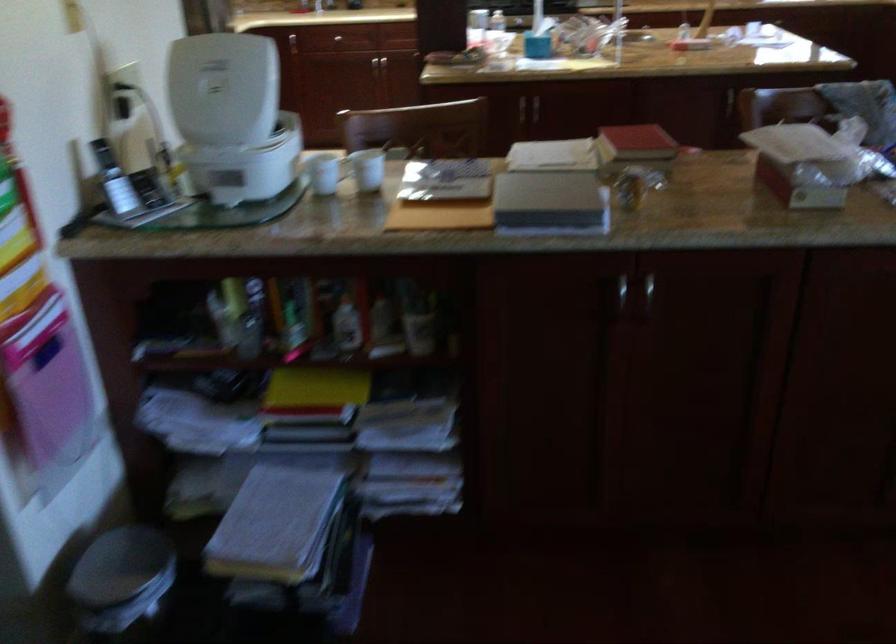
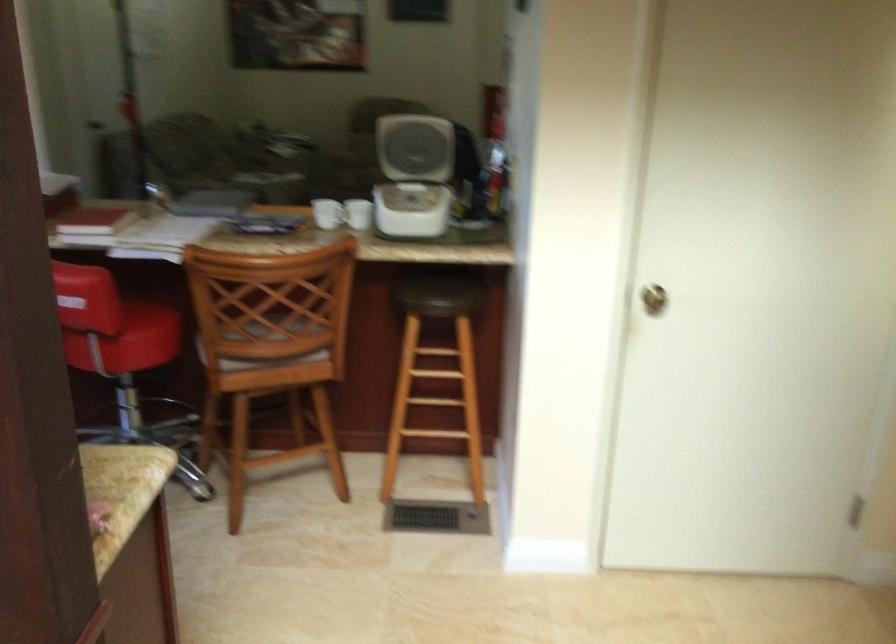
Find the pixel in the second image that matches (x=324, y=182) in the first image.

(358, 214)